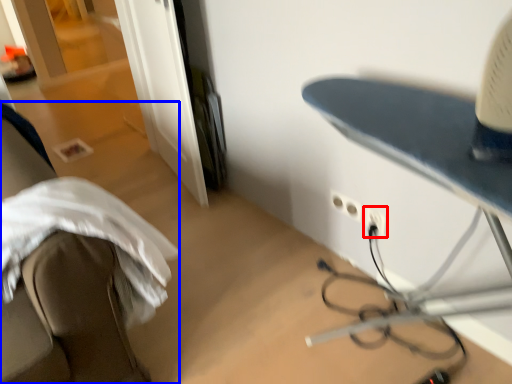
Question: Which object appears farthest to the camera in this image, electric outlet (highlighted by a red box) or furniture (highlighted by a blue box)?

Choices:
 (A) electric outlet
 (B) furniture

Answer: (A)